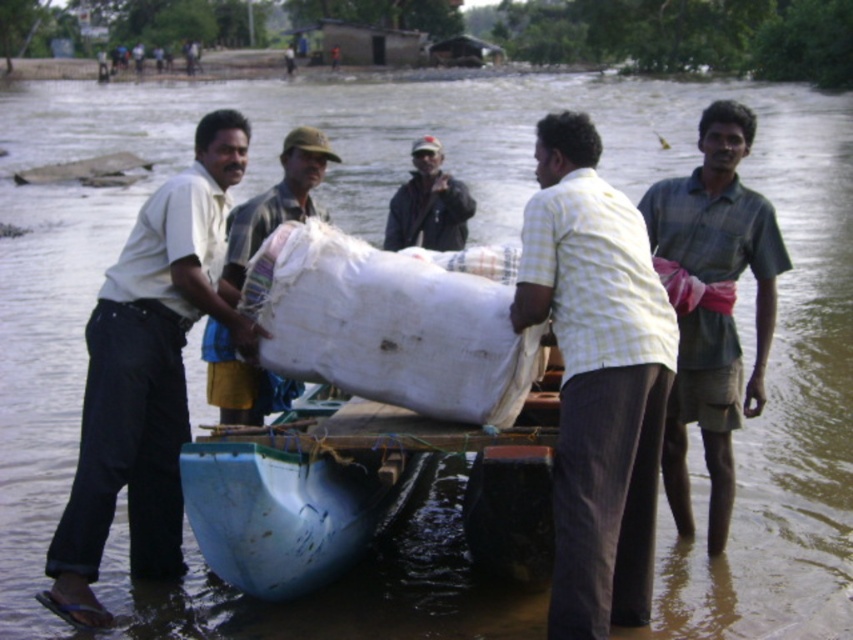
Question: Is white cotton shirt at left to the right of green cotton shirt at right from the viewer's perspective?

Choices:
 (A) no
 (B) yes

Answer: (A)

Question: Can you confirm if light yellow checkered shirt at center is wider than light brown fabric bag at center?

Choices:
 (A) no
 (B) yes

Answer: (A)

Question: Can you confirm if white cotton shirt at left is positioned to the left of dark gray jacket at center?

Choices:
 (A) no
 (B) yes

Answer: (B)

Question: Estimate the real-world distances between objects in this image. Which object is farther from the light yellow checkered shirt at center?

Choices:
 (A) green cotton shirt at right
 (B) light brown fabric bag at center
 (C) dark gray jacket at center
 (D) blue plastic boat at center

Answer: (C)

Question: Which point appears farthest from the camera in this image?

Choices:
 (A) (699, 259)
 (B) (434, 166)

Answer: (B)

Question: Which of the following is the farthest from the observer?

Choices:
 (A) (395, 202)
 (B) (138, 380)

Answer: (A)